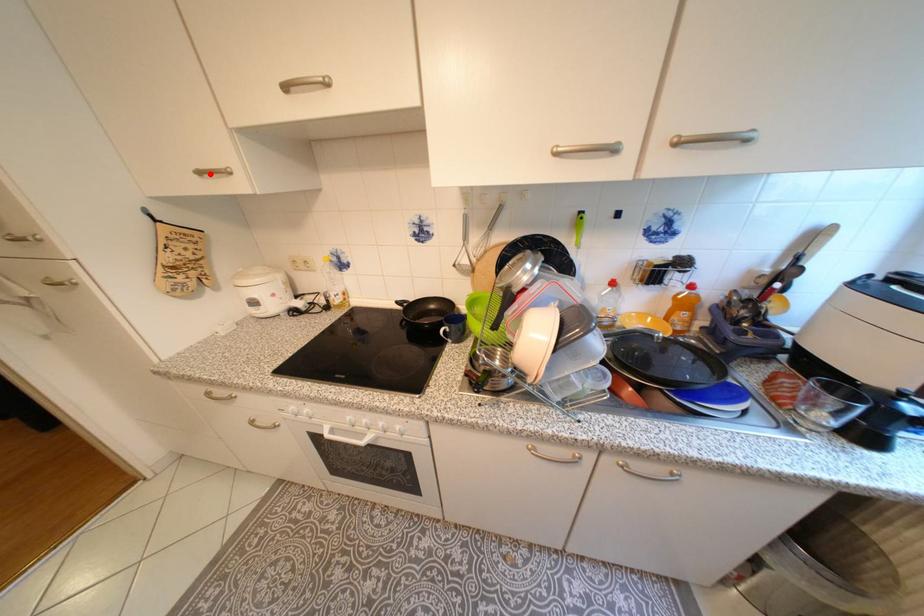
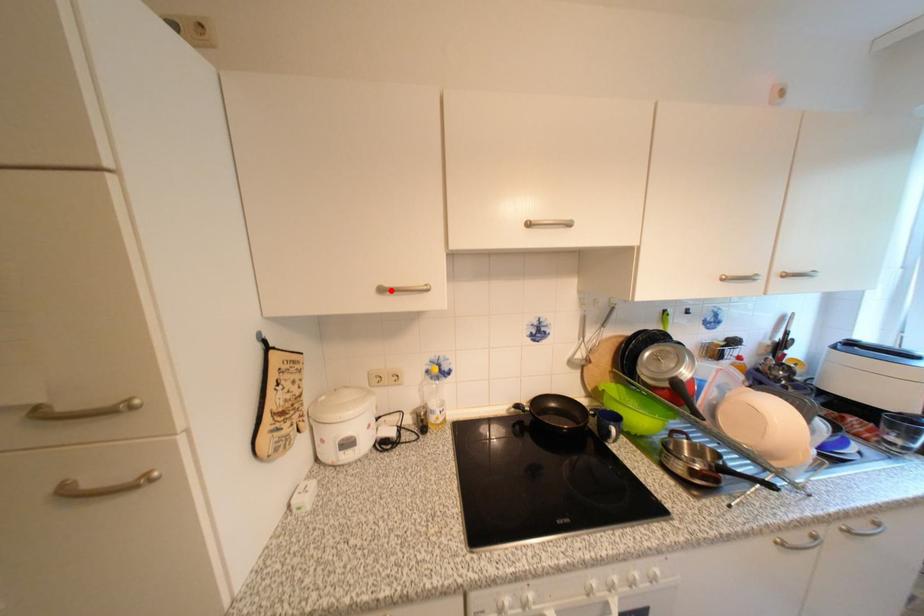
I am providing you with two images of the same scene from different viewpoints. A red point is marked on the first image and another point is marked on the second image. Is the marked point in image1 the same physical position as the marked point in image2?

Yes